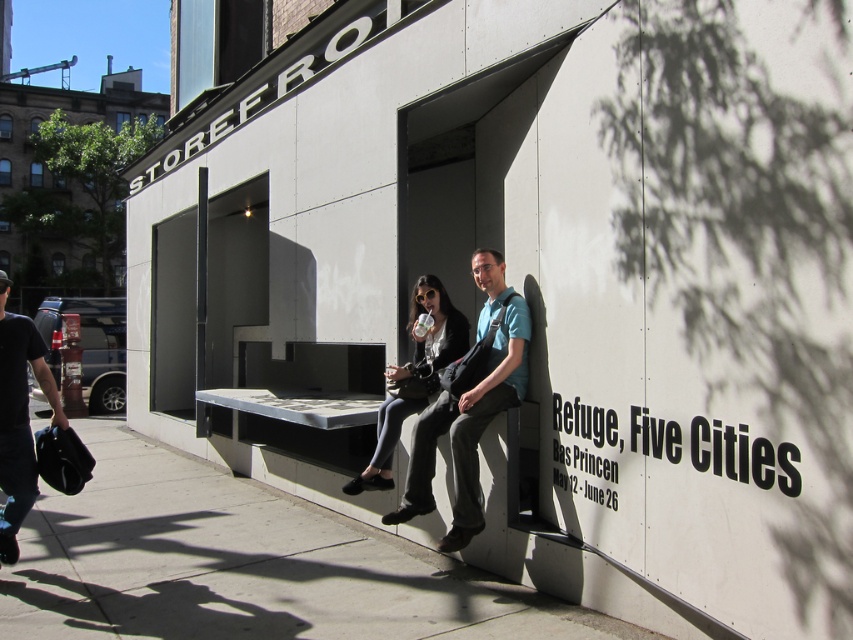
Question: Which is farther from the gray concrete bench at lower center?

Choices:
 (A) matte black bench at center
 (B) matte black jacket at center
 (C) black leather bag at lower left

Answer: (A)

Question: Does matte black bench at center have a smaller size compared to matte black jacket at center?

Choices:
 (A) no
 (B) yes

Answer: (A)

Question: Based on their relative distances, which object is farther from the matte black jacket at center?

Choices:
 (A) gray concrete bench at lower center
 (B) black leather bag at lower left
 (C) matte black bench at center

Answer: (B)

Question: Which point is closer to the camera taking this photo?

Choices:
 (A) (492, 260)
 (B) (457, 323)

Answer: (A)

Question: Is the position of gray concrete bench at lower center less distant than that of matte black jacket at center?

Choices:
 (A) no
 (B) yes

Answer: (B)

Question: Does black leather bag at lower left appear on the left side of matte black jacket at center?

Choices:
 (A) yes
 (B) no

Answer: (A)